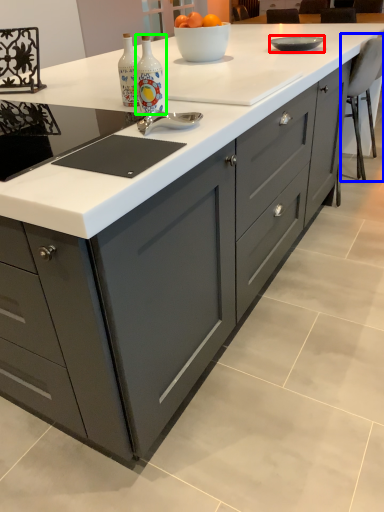
Question: Which object is positioned farthest from bowl (highlighted by a red box)? Select from chair (highlighted by a blue box) and bottle (highlighted by a green box).

Choices:
 (A) chair
 (B) bottle

Answer: (B)